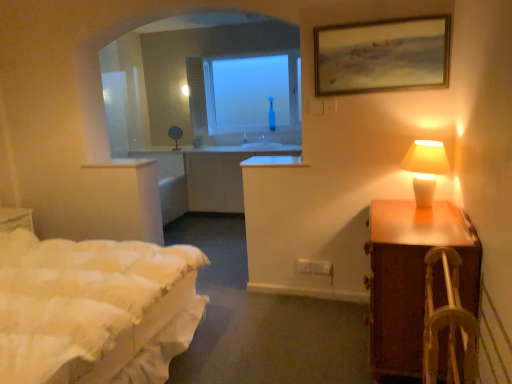
Question: Is wooden framed painting at upper right not close to brown wooden nightstand at right?

Choices:
 (A) yes
 (B) no

Answer: (A)

Question: Is wooden framed painting at upper right next to brown wooden nightstand at right?

Choices:
 (A) no
 (B) yes

Answer: (A)

Question: Can you confirm if wooden framed painting at upper right is taller than brown wooden nightstand at right?

Choices:
 (A) yes
 (B) no

Answer: (B)

Question: Is wooden framed painting at upper right oriented towards brown wooden nightstand at right?

Choices:
 (A) yes
 (B) no

Answer: (B)

Question: Can you confirm if wooden framed painting at upper right is wider than brown wooden nightstand at right?

Choices:
 (A) yes
 (B) no

Answer: (B)

Question: Considering the positions of brown wooden nightstand at right and white quilted bed at left in the image, is brown wooden nightstand at right wider or thinner than white quilted bed at left?

Choices:
 (A) wide
 (B) thin

Answer: (B)

Question: Is point (400, 370) positioned closer to the camera than point (120, 246)?

Choices:
 (A) farther
 (B) closer

Answer: (B)

Question: Is brown wooden nightstand at right inside or outside of white quilted bed at left?

Choices:
 (A) inside
 (B) outside

Answer: (B)

Question: Is brown wooden nightstand at right taller or shorter than white quilted bed at left?

Choices:
 (A) tall
 (B) short

Answer: (B)

Question: Is wooden woven armchair at right wider or thinner than white ceramic lamp at right?

Choices:
 (A) wide
 (B) thin

Answer: (A)

Question: Based on their sizes in the image, would you say wooden woven armchair at right is bigger or smaller than white ceramic lamp at right?

Choices:
 (A) big
 (B) small

Answer: (A)

Question: Is point (426, 332) closer or farther from the camera than point (417, 155)?

Choices:
 (A) closer
 (B) farther

Answer: (A)

Question: From the image's perspective, is wooden woven armchair at right positioned above or below white ceramic lamp at right?

Choices:
 (A) below
 (B) above

Answer: (A)

Question: From a real-world perspective, is white ceramic lamp at right positioned above or below brown wooden nightstand at right?

Choices:
 (A) above
 (B) below

Answer: (A)

Question: Do you think white ceramic lamp at right is within brown wooden nightstand at right, or outside of it?

Choices:
 (A) inside
 (B) outside

Answer: (B)